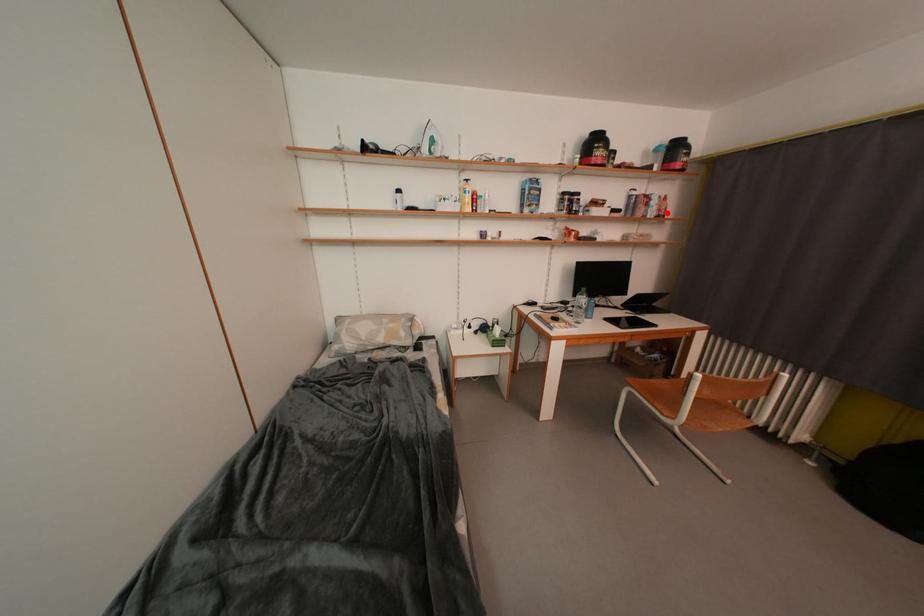
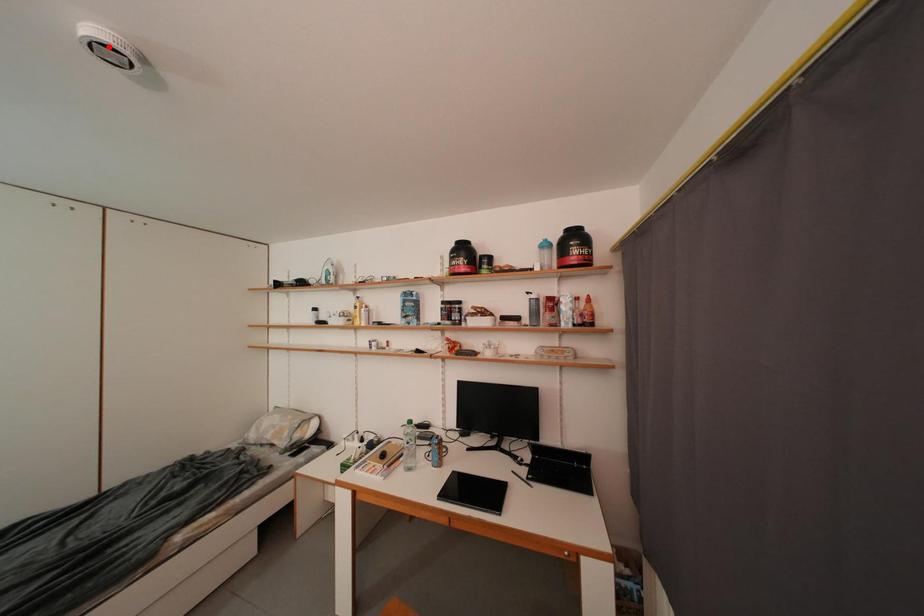
I am providing you with two images of the same scene from different viewpoints. A red point is marked on the first image and another point is marked on the second image. Is the marked point in image1 the same physical position as the marked point in image2?

No